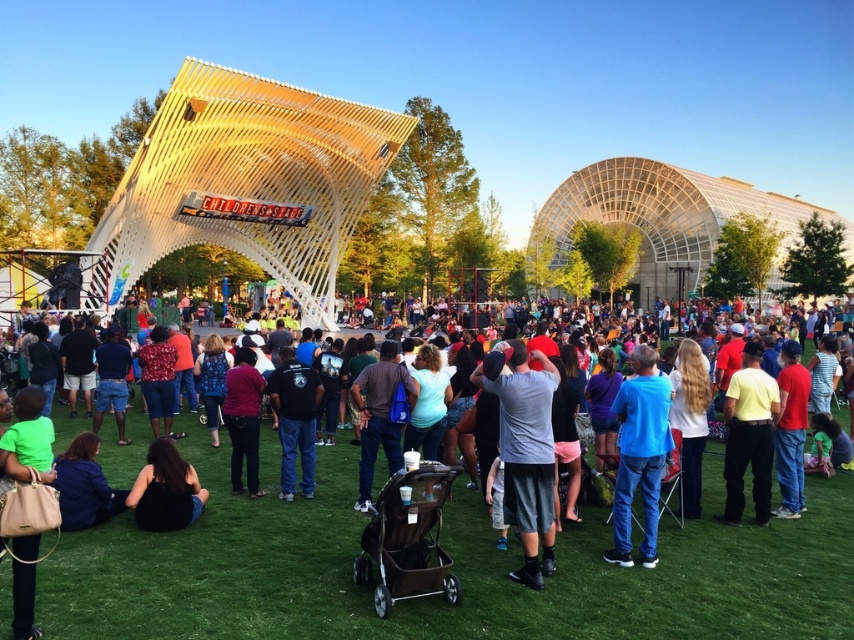
The height and width of the screenshot is (640, 854). Describe the element at coordinates (165, 490) in the screenshot. I see `black fabric at lower center` at that location.

Does black fabric at lower center have a lesser width compared to red cotton shirt at center?

Correct, black fabric at lower center's width is less than red cotton shirt at center's.

Does point (144, 500) lie behind point (781, 371)?

No, it is not.

Identify the location of black fabric at lower center. Image resolution: width=854 pixels, height=640 pixels. (165, 490).

Is point (765, 381) positioned in front of point (285, 371)?

Yes, point (765, 381) is closer to viewer.

Is point (755, 492) positioned after point (291, 362)?

That is False.

Does point (746, 356) lie in front of point (284, 477)?

That is False.

Find the location of a particular element. This screenshot has height=640, width=854. yellow matte shirt at center-right is located at coordinates (749, 435).

Does green artificial turf at lower center have a larger size compared to black fabric at lower center?

Indeed, green artificial turf at lower center has a larger size compared to black fabric at lower center.

Describe the element at coordinates (451, 570) in the screenshot. I see `green artificial turf at lower center` at that location.

Find the location of a particular element. green artificial turf at lower center is located at coordinates (451, 570).